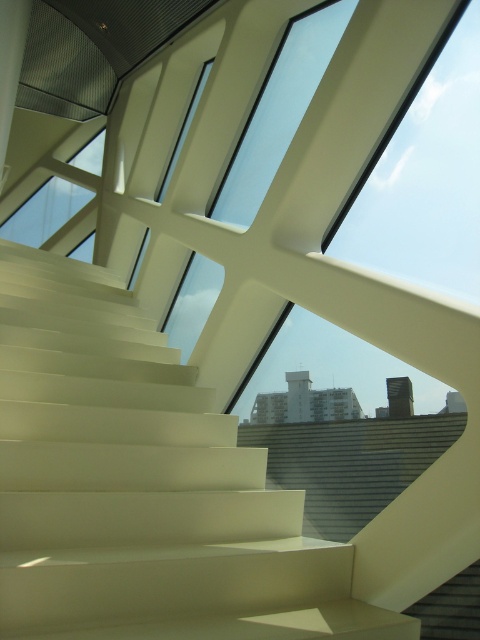
Between white glossy stairs at center and transparent glass window at upper center, which one has more height?

transparent glass window at upper center is taller.

How much distance is there between white glossy stairs at center and transparent glass window at upper center?

The distance of white glossy stairs at center from transparent glass window at upper center is 2.22 meters.

Find the location of a particular element. white glossy stairs at center is located at coordinates pos(142,486).

Is point (232, 628) closer to viewer compared to point (97, 173)?

Yes, it is in front of point (97, 173).

Is point (39, 525) positioned behind point (4, 234)?

No, (39, 525) is closer to viewer.

Find the location of a particular element. The image size is (480, 640). white glossy stairs at center is located at coordinates (142, 486).

Does transparent glass window at upper center have a smaller size compared to transparent glass window at upper left?

No.

Who is positioned more to the left, transparent glass window at upper center or transparent glass window at upper left?

From the viewer's perspective, transparent glass window at upper left appears more on the left side.

Who is more forward, (188, 288) or (61, 211)?

Positioned in front is point (188, 288).

This screenshot has height=640, width=480. I want to click on transparent glass window at upper center, so click(x=279, y=109).